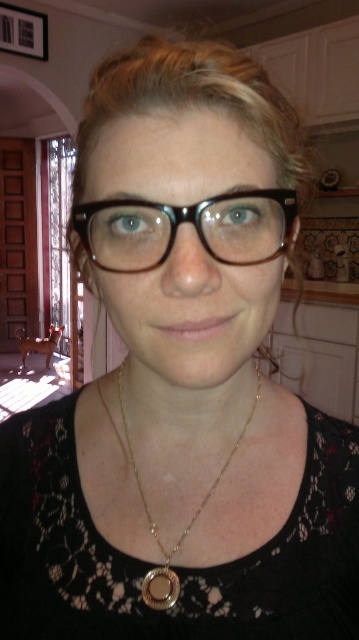
Looking at this image, can you confirm if black plastic glasses at center is smaller than gold chain at center?

Correct, black plastic glasses at center occupies less space than gold chain at center.

Is point (249, 196) positioned before point (252, 404)?

Yes, it is.

This screenshot has height=640, width=359. Identify the location of black plastic glasses at center. (189, 221).

The height and width of the screenshot is (640, 359). Find the location of `black plastic glasses at center`. black plastic glasses at center is located at coordinates (189, 221).